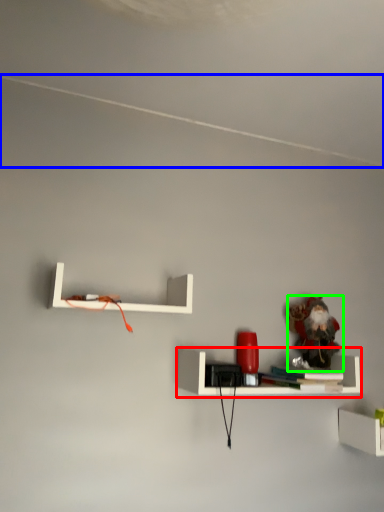
Question: Which object is the closest to the shelf (highlighted by a red box)? Choose among these: line (highlighted by a blue box) or toy (highlighted by a green box).

Choices:
 (A) line
 (B) toy

Answer: (B)